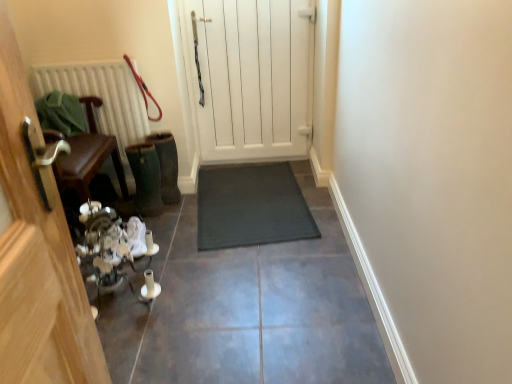
At what (x,y) coordinates should I click in order to perform the action: click on vacant space in between white wooden door at center, marked as the 2th door in a left-to-right arrangement, and dark gray rubber mat at center. Please return your answer as a coordinate pair (x, y). Looking at the image, I should click on (308, 187).